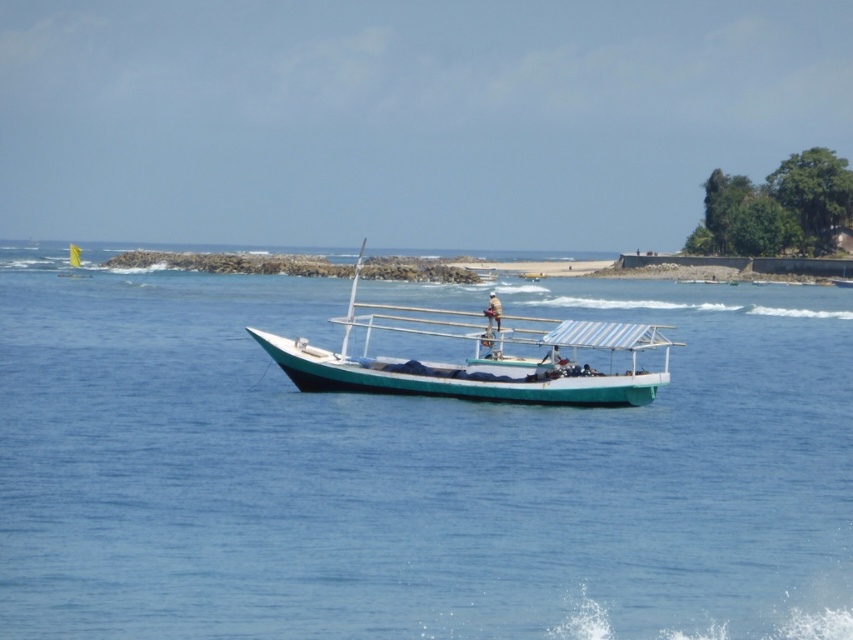
Question: Which of the following is the farthest from the observer?

Choices:
 (A) teal matte boat at center
 (B) blue water at center

Answer: (A)

Question: Is blue water at center positioned behind teal matte boat at center?

Choices:
 (A) yes
 (B) no

Answer: (B)

Question: Which object appears farthest from the camera in this image?

Choices:
 (A) blue water at center
 (B) teal matte boat at center

Answer: (B)

Question: Among these points, which one is nearest to the camera?

Choices:
 (A) pyautogui.click(x=480, y=355)
 (B) pyautogui.click(x=71, y=332)

Answer: (A)

Question: Is blue water at center to the left of teal matte boat at center from the viewer's perspective?

Choices:
 (A) yes
 (B) no

Answer: (A)

Question: Can you confirm if blue water at center is wider than teal matte boat at center?

Choices:
 (A) yes
 (B) no

Answer: (A)